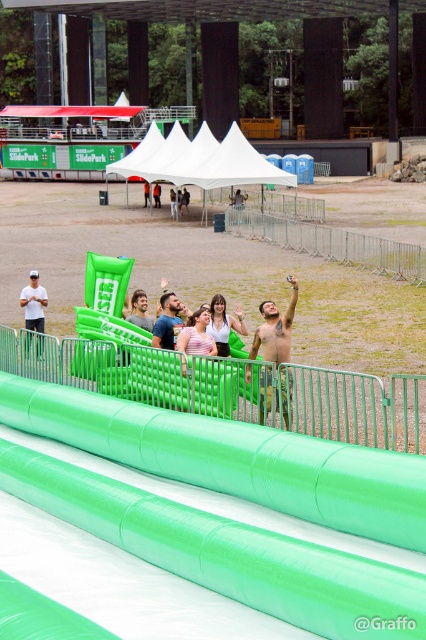
Does green rubber slide at center appear over green rubber rail at center?

No, green rubber slide at center is not above green rubber rail at center.

Consider the image. Is green rubber slide at center taller than green rubber rail at center?

Yes, green rubber slide at center is taller than green rubber rail at center.

Is point (305, 468) more distant than point (337, 428)?

No, (305, 468) is in front of (337, 428).

The height and width of the screenshot is (640, 426). I want to click on green rubber slide at center, so click(x=207, y=522).

Is green rubber rail at center positioned behind smooth blue shirt at center?

No, it is in front of smooth blue shirt at center.

Consider the image. Which is above, green rubber rail at center or smooth blue shirt at center?

smooth blue shirt at center is above.

Locate an element on the screen. green rubber rail at center is located at coordinates (233, 387).

Identify the location of matte green inflatable at center. (224, 323).

Is matte green inflatable at center taller than smooth blue shirt at center?

Yes.

Where is `matte green inflatable at center`? The width and height of the screenshot is (426, 640). matte green inflatable at center is located at coordinates (224, 323).

Locate an element on the screen. matte green inflatable at center is located at coordinates (224, 323).